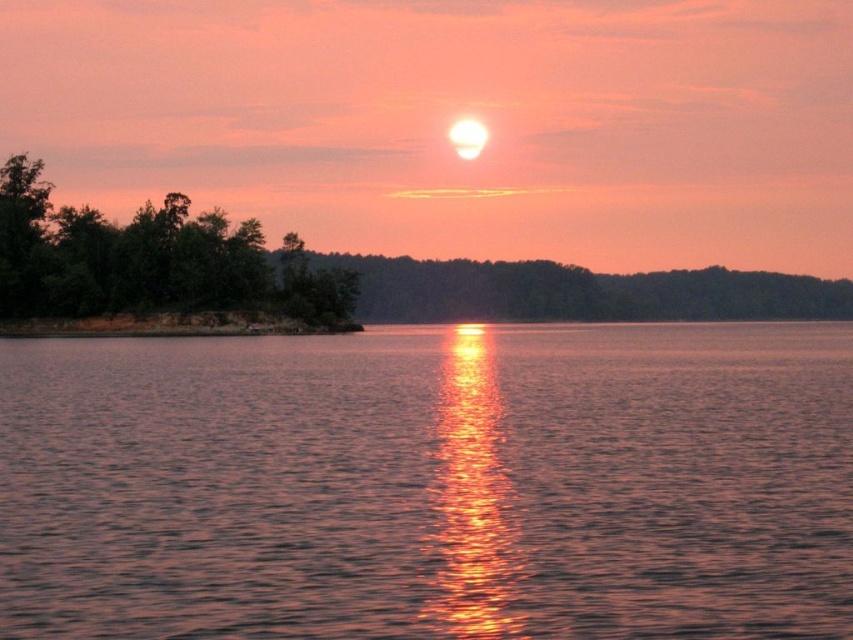
You are standing on the shore and want to take a photo of both the shiny reflective water at center and the green matte trees at left. Which object should you frame first in your camera viewfinder to ensure both are visible?

You should frame the green matte trees at left first because the shiny reflective water at center is positioned on the right side of green matte trees at left, so placing the trees on the left side of the viewfinder will allow the water to naturally appear on their right without cropping either object.

You are standing at the bottom center of the image and want to walk towards the sun. Which point, point (399,330) or point (289,264), will you encounter first?

You will encounter point (289,264) first because it is closer to your starting position at the bottom center compared to point (399,330), which is further away.

You are standing on the lakeshore and want to take a photo of both the shiny reflective water at center and the green matte trees at left. Which object should you position closer to the camera to ensure both are in focus?

You should position the shiny reflective water at center closer to the camera because it is in front of the green matte trees at left, so bringing it forward will help both objects be in focus.